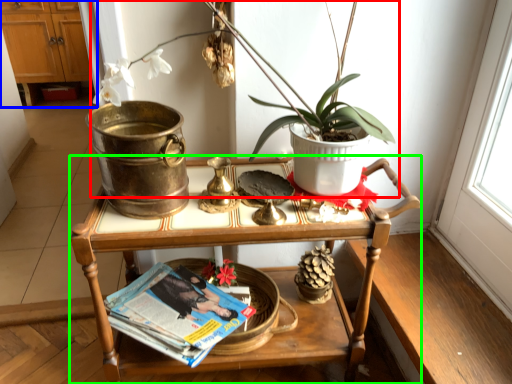
Question: Based on their relative distances, which object is nearer to houseplant (highlighted by a red box)? Choose from dresser (highlighted by a blue box) and table (highlighted by a green box).

Choices:
 (A) dresser
 (B) table

Answer: (B)